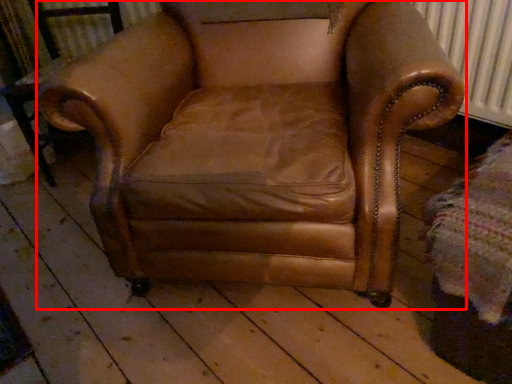
Question: Observing the image, what is the correct spatial positioning of chair (annotated by the red box) in reference to side table?

Choices:
 (A) left
 (B) right

Answer: (B)